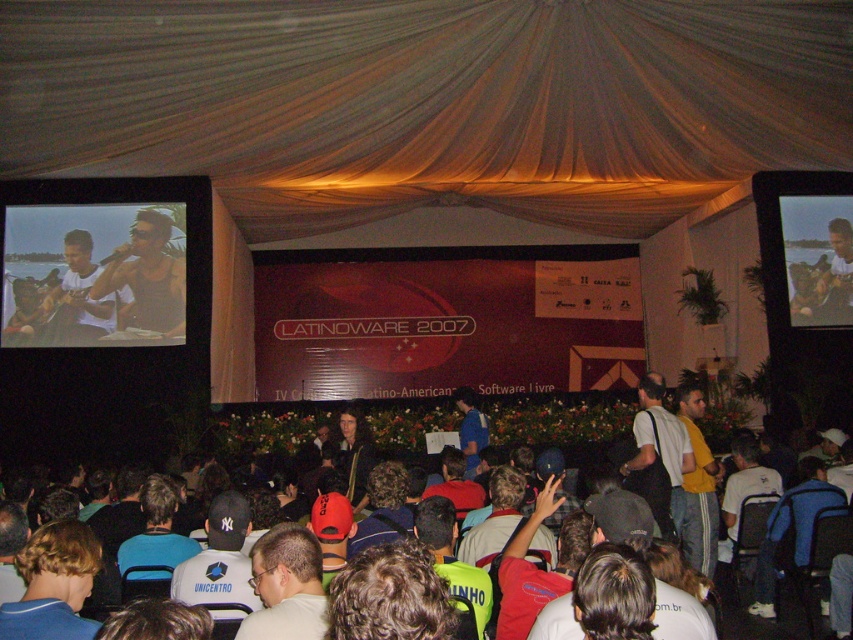
Who is taller, silky beige curtain at upper center or matte black tank top at upper left?

Standing taller between the two is matte black tank top at upper left.

Can you confirm if silky beige curtain at upper center is taller than matte black tank top at upper left?

No.

Identify the location of silky beige curtain at upper center. (428, 100).

Can you confirm if blue shirt at lower left is positioned below yellow cotton shirt at right?

Incorrect, blue shirt at lower left is not positioned below yellow cotton shirt at right.

Which is more to the right, blue shirt at lower left or yellow cotton shirt at right?

From the viewer's perspective, yellow cotton shirt at right appears more on the right side.

Describe the element at coordinates (53, 584) in the screenshot. Image resolution: width=853 pixels, height=640 pixels. I see `blue shirt at lower left` at that location.

Locate an element on the screen. The width and height of the screenshot is (853, 640). blue shirt at lower left is located at coordinates (53, 584).

Who is shorter, dark brown hair at center or white fabric cap at center?

dark brown hair at center is shorter.

Which is below, dark brown hair at center or white fabric cap at center?

white fabric cap at center

The image size is (853, 640). In order to click on dark brown hair at center in this screenshot , I will do `click(390, 595)`.

The image size is (853, 640). In order to click on dark brown hair at center in this screenshot , I will do `click(390, 595)`.